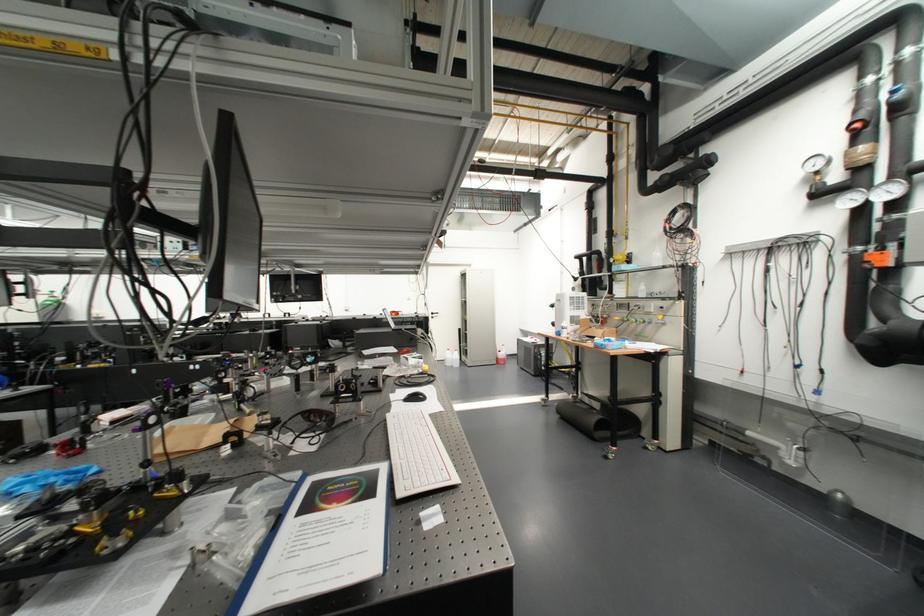
The location [500,355] corresponds to which object?

It corresponds to the red plastic bottle in the image.